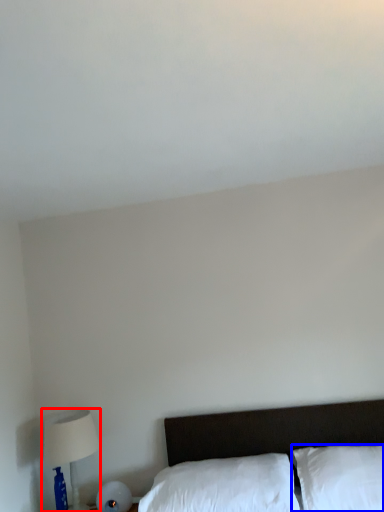
Question: Among these objects, which one is farthest to the camera, table lamp (highlighted by a red box) or pillow (highlighted by a blue box)?

Choices:
 (A) table lamp
 (B) pillow

Answer: (A)